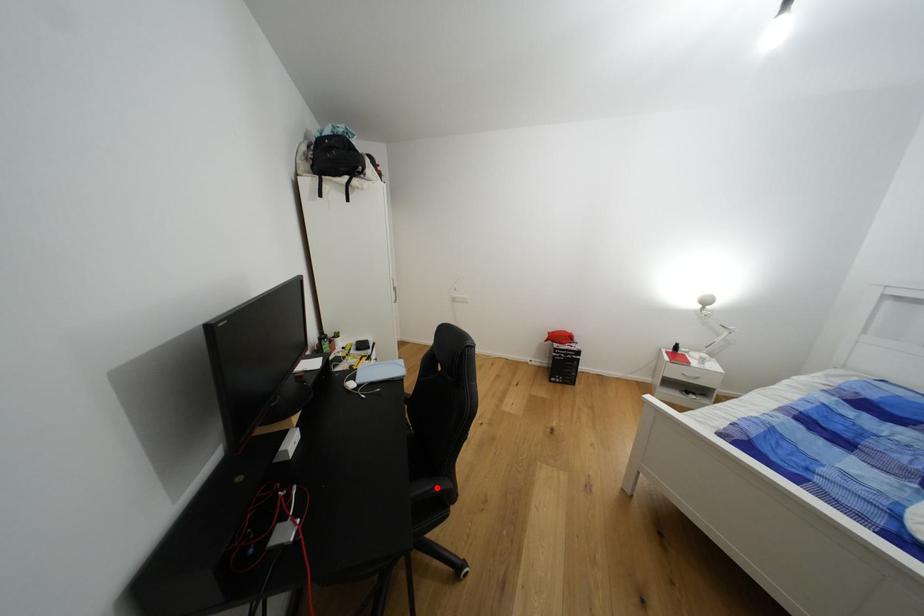
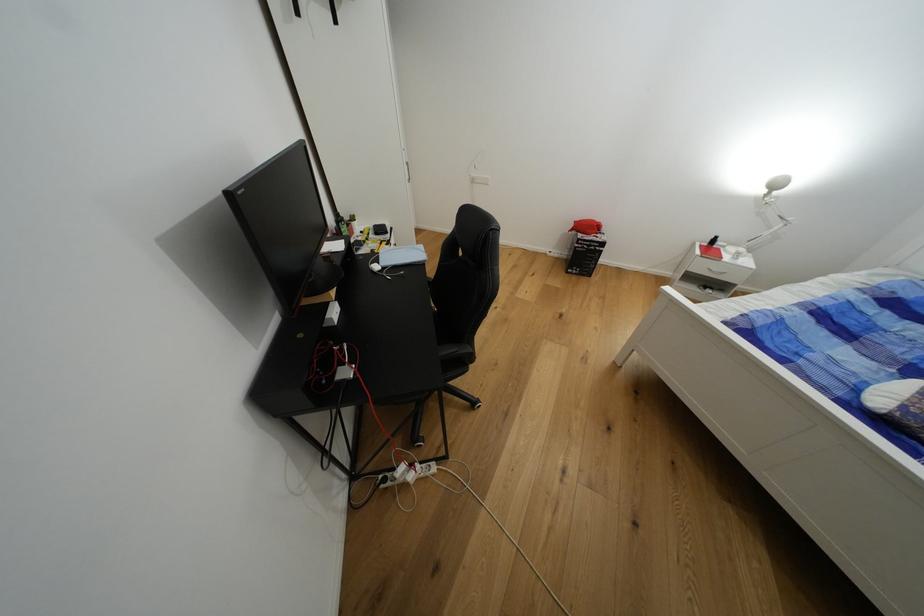
Question: I am providing you with two images of the same scene from different viewpoints. A red point is shown in image1. For the corresponding object point in image2, is it positioned nearer or farther from the camera?

Choices:
 (A) Nearer
 (B) Farther

Answer: (B)